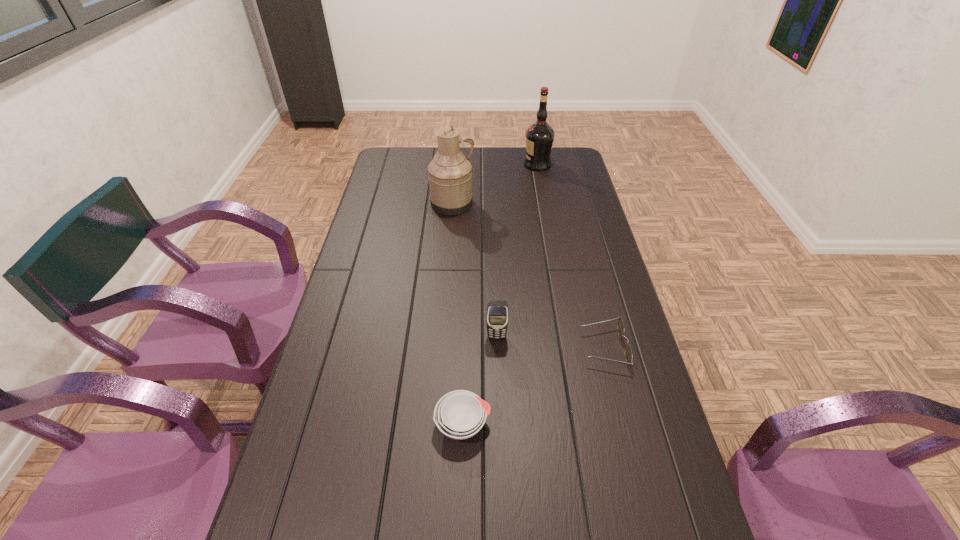
The width and height of the screenshot is (960, 540). Identify the location of free space located 0.320m on the front-facing side of the spectacles. (466, 348).

This screenshot has width=960, height=540. Find the location of `free space located 0.150m on the front-facing side of the spectacles`. free space located 0.150m on the front-facing side of the spectacles is located at coordinates (528, 348).

This screenshot has height=540, width=960. In order to click on vacant space located on the front-facing side of the spectacles in this screenshot , I will do `click(546, 348)`.

I want to click on free space located 0.310m on the back of the nearest object, so click(x=467, y=308).

Where is `object at the far edge`? object at the far edge is located at coordinates (540, 135).

At what (x,y) coordinates should I click in order to perform the action: click on liquor positioned at the right edge. Please return your answer as a coordinate pair (x, y). The width and height of the screenshot is (960, 540). Looking at the image, I should click on (540, 135).

What are the coordinates of `spectacles situated at the right edge` in the screenshot? It's located at (620, 327).

Identify the location of object located at the far right corner. The image size is (960, 540). (540, 135).

In the image, there is a desktop. Identify the location of vacant space at the far edge. (487, 170).

Find the location of a particular element. This screenshot has height=540, width=960. vacant space at the left edge of the desktop is located at coordinates click(376, 181).